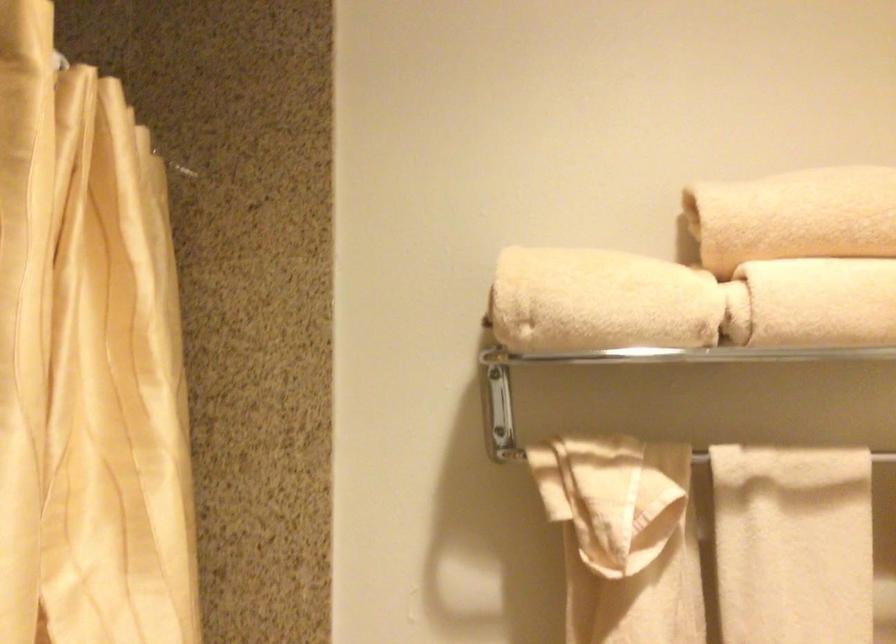
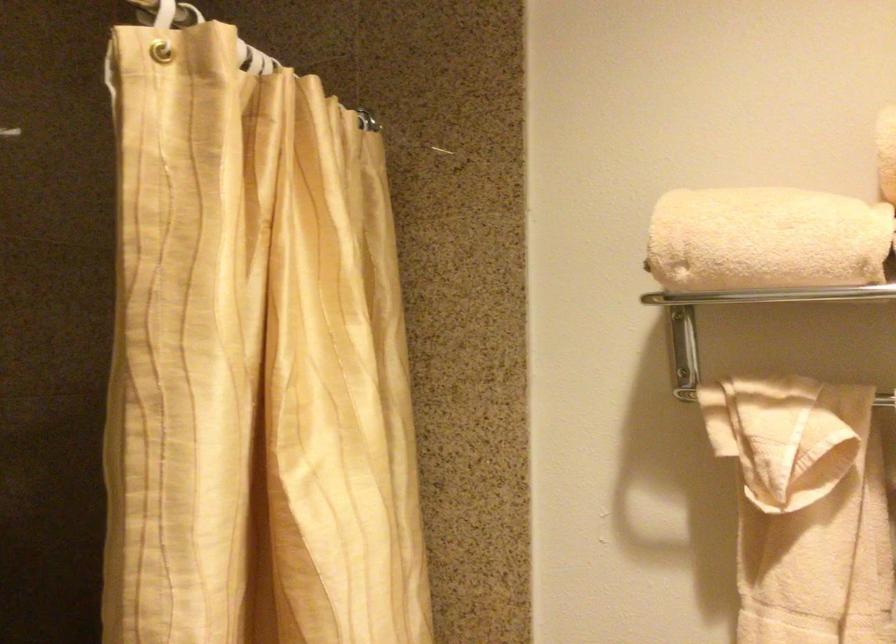
Question: In a continuous first-person perspective shot, in which direction is the camera moving?

Choices:
 (A) Left
 (B) Right
 (C) Forward
 (D) Backward

Answer: (B)